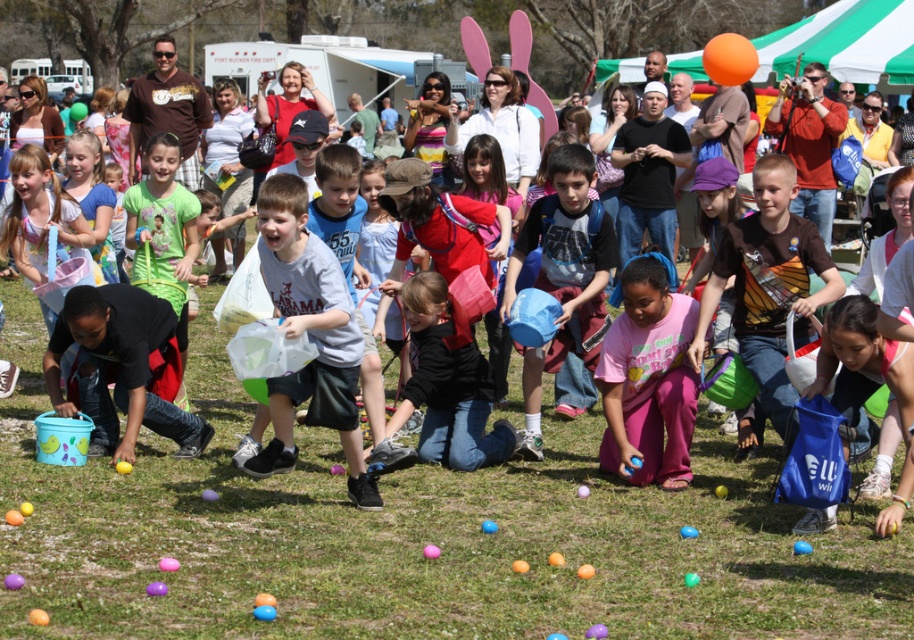
You are a parent at the Easter egg hunt and want to ensure your child can easily see the eggs on the ground. Considering the green grass at center and the black matte jacket at center, which object is shorter and thus less likely to block the child from spotting the eggs?

The green grass at center has a lesser height compared to the black matte jacket at center, so the green grass at center is shorter and less likely to block the child from spotting the eggs.

You are a parent at the Easter egg hunt. You need to place a small gift box on the green grass at center so that it won not be easily seen by the children searching for eggs. Where should you place it in relation to the black matte jacket at center?

Since the green grass at center is wider than the black matte jacket at center, placing the gift box on the green grass at center to the side opposite of the black matte jacket at center would help conceal it better from the children searching in that area.